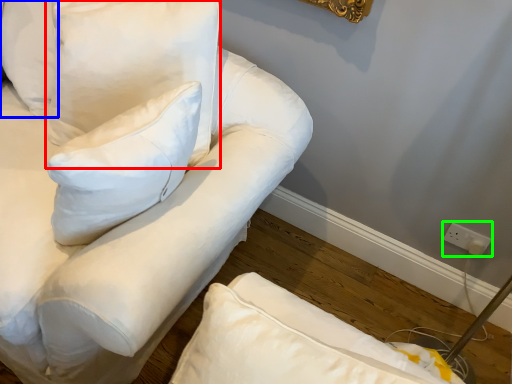
Question: Which object is the closest to the pillow (highlighted by a red box)? Choose among these: pillow (highlighted by a blue box) or electric outlet (highlighted by a green box).

Choices:
 (A) pillow
 (B) electric outlet

Answer: (A)